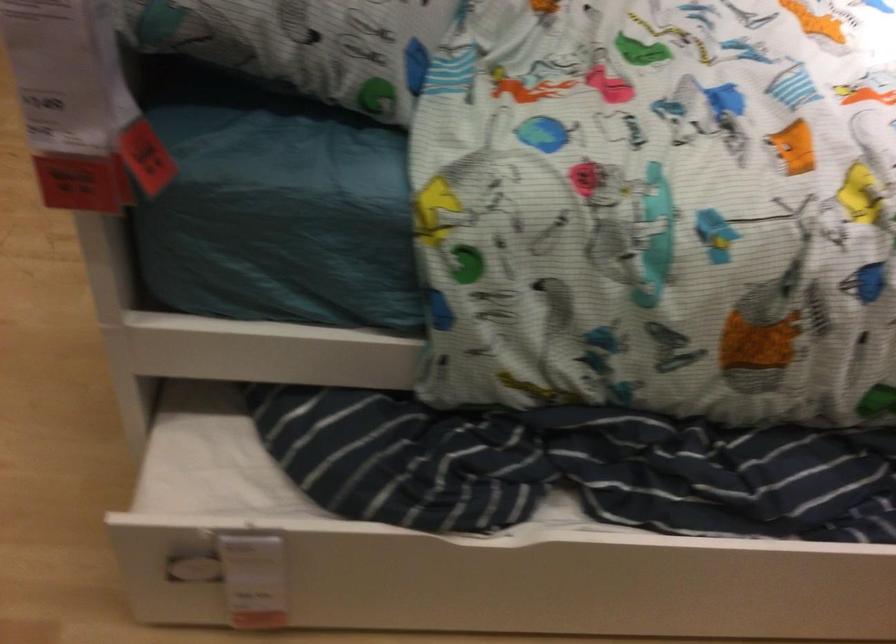
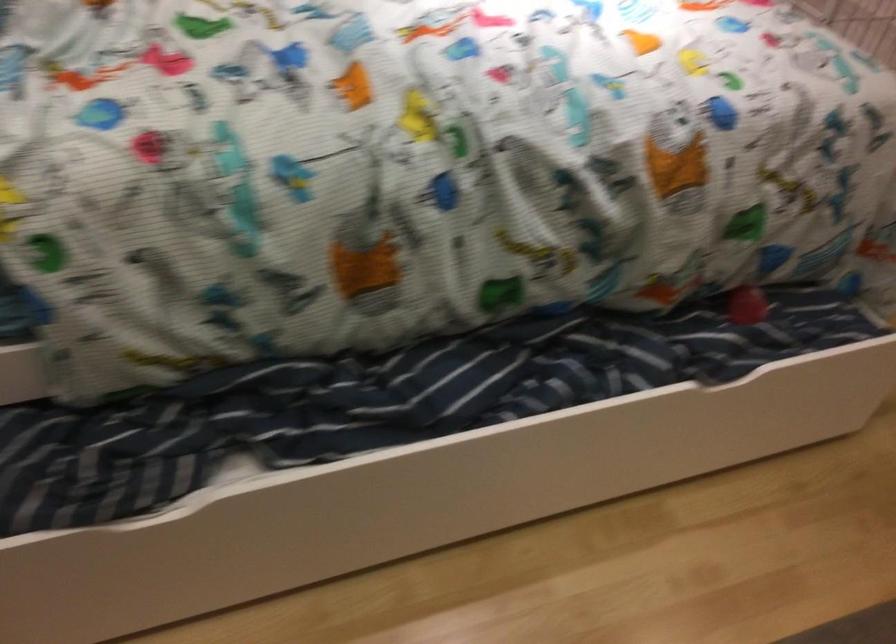
In a continuous first-person perspective shot, in which direction is the camera moving?

The cameraman moved toward right, backward.